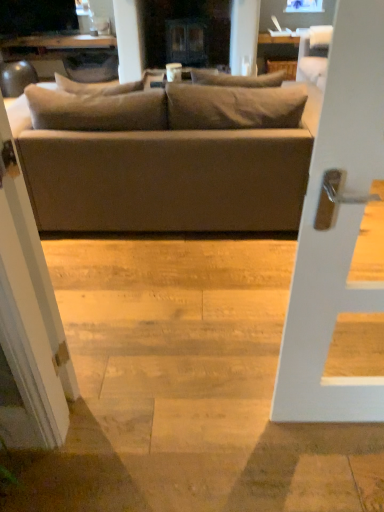
The width and height of the screenshot is (384, 512). Identify the location of vacant space in front of white matte door handle at center. (328, 465).